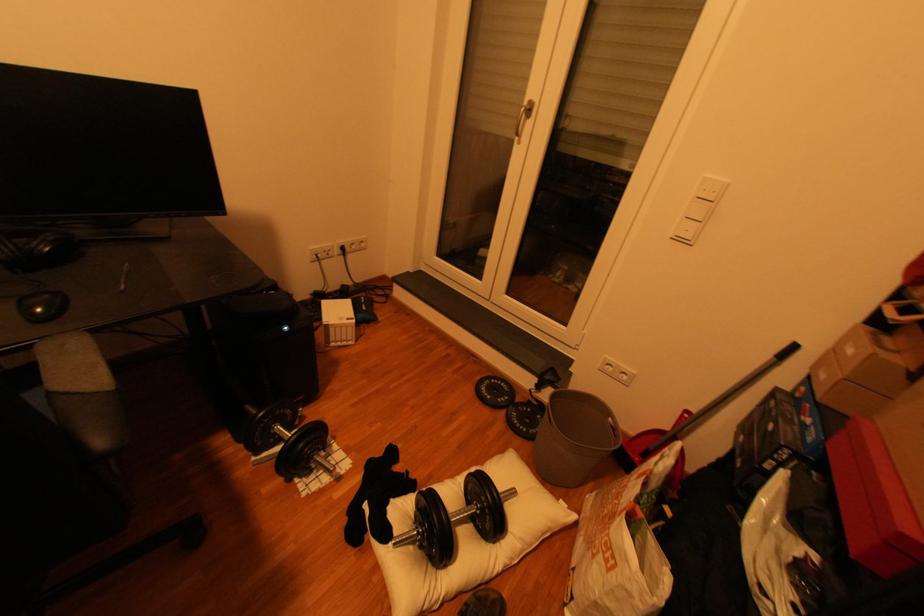
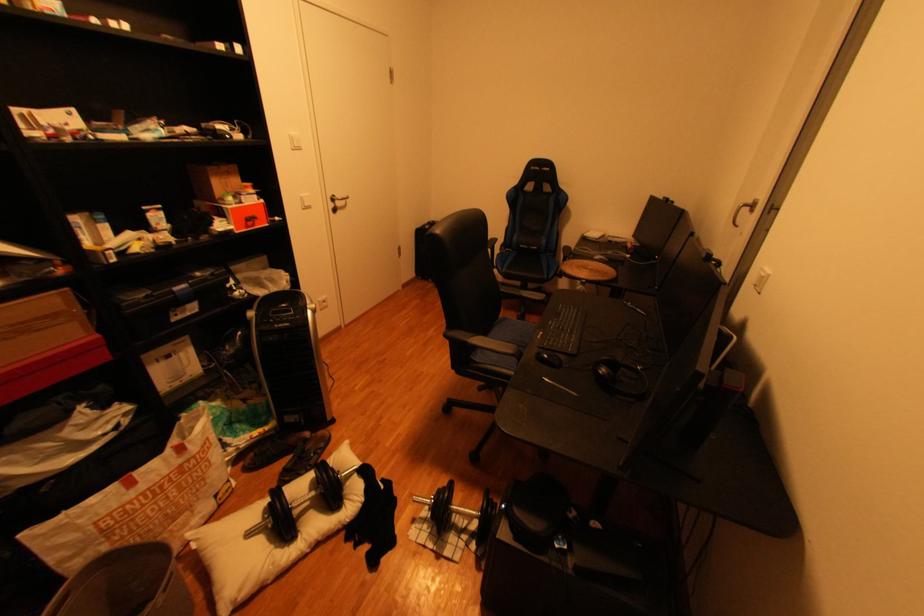
Locate, in the second image, the point that corresponds to the point at 339,456 in the first image.

(440, 533)